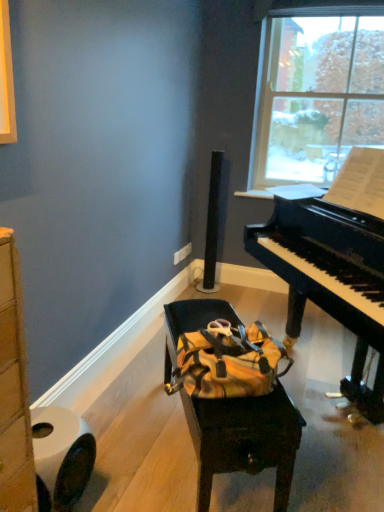
Where is `unoccupied region to the right of yellow fabric bag at center`? unoccupied region to the right of yellow fabric bag at center is located at coordinates (327, 436).